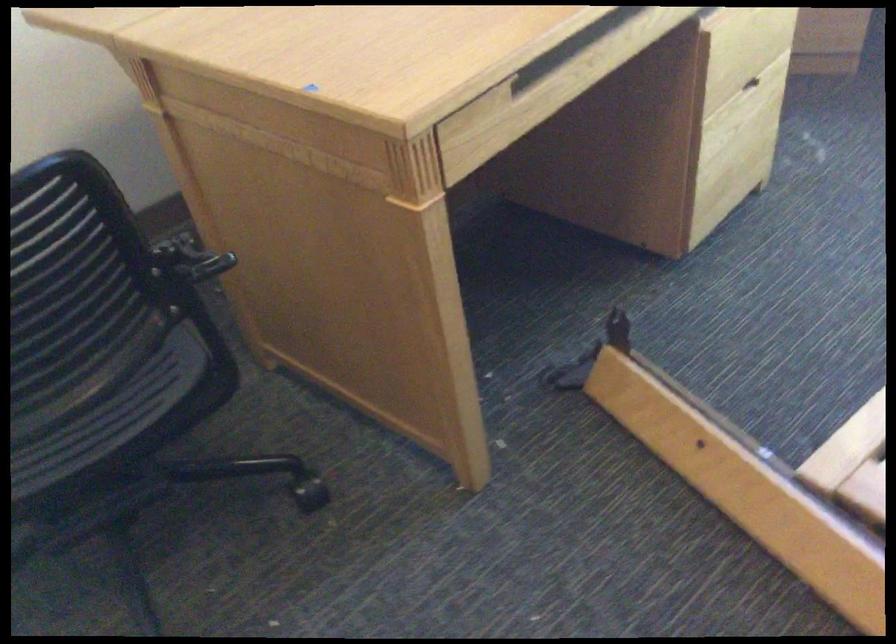
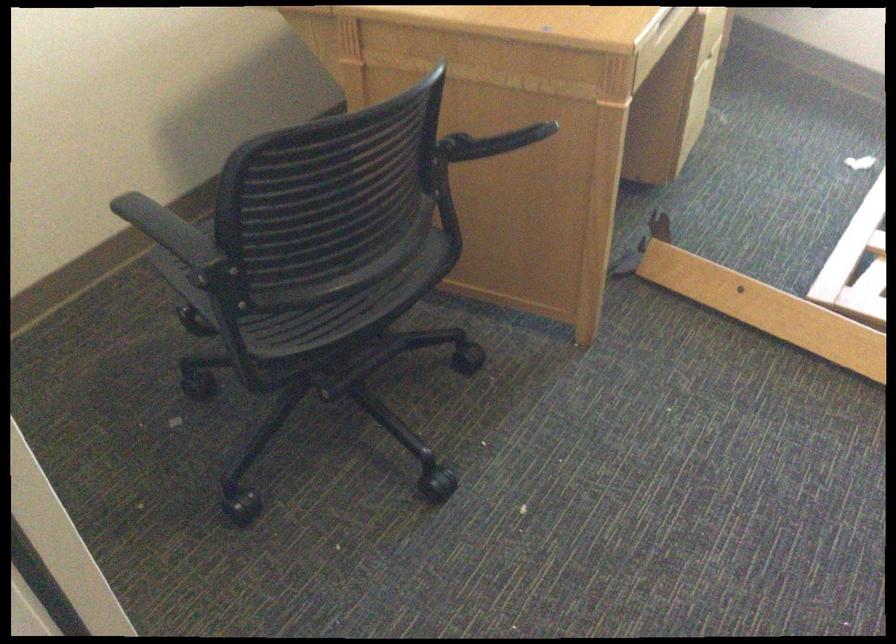
Find the pixel in the second image that matches point 722,471 in the first image.

(767, 308)